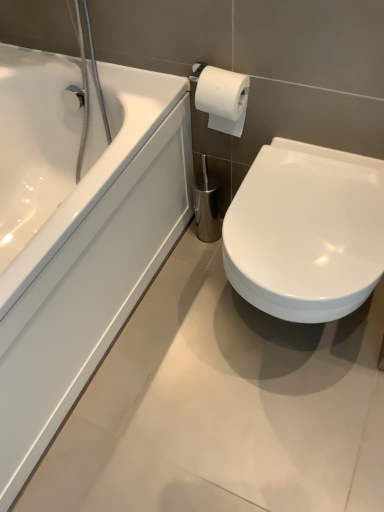
Question: Is white glossy bathtub at left placed right next to white glossy toilet at lower right?

Choices:
 (A) yes
 (B) no

Answer: (B)

Question: Is white glossy bathtub at left further to the viewer compared to white glossy toilet at lower right?

Choices:
 (A) yes
 (B) no

Answer: (B)

Question: From the image's perspective, does white glossy bathtub at left appear higher than white glossy toilet at lower right?

Choices:
 (A) yes
 (B) no

Answer: (A)

Question: Considering the relative positions of white glossy bathtub at left and white glossy toilet at lower right in the image provided, is white glossy bathtub at left to the right of white glossy toilet at lower right from the viewer's perspective?

Choices:
 (A) yes
 (B) no

Answer: (B)

Question: Would you consider white glossy bathtub at left to be distant from white glossy toilet at lower right?

Choices:
 (A) no
 (B) yes

Answer: (A)

Question: Is white glossy bathtub at left smaller than white glossy toilet at lower right?

Choices:
 (A) no
 (B) yes

Answer: (A)

Question: Is white glossy toilet at lower right touching white glossy bathtub at left?

Choices:
 (A) yes
 (B) no

Answer: (B)

Question: Does white glossy toilet at lower right appear on the right side of white glossy bathtub at left?

Choices:
 (A) no
 (B) yes

Answer: (B)

Question: Is white glossy toilet at lower right further to the viewer compared to white glossy bathtub at left?

Choices:
 (A) yes
 (B) no

Answer: (A)

Question: Is white glossy toilet at lower right positioned far away from white glossy bathtub at left?

Choices:
 (A) no
 (B) yes

Answer: (A)

Question: Is white glossy toilet at lower right turned away from white glossy bathtub at left?

Choices:
 (A) no
 (B) yes

Answer: (A)

Question: Is white glossy toilet at lower right closer to camera compared to white glossy bathtub at left?

Choices:
 (A) yes
 (B) no

Answer: (B)

Question: From a real-world perspective, relative to white glossy toilet at lower right, is white glossy bathtub at left vertically above or below?

Choices:
 (A) below
 (B) above

Answer: (B)